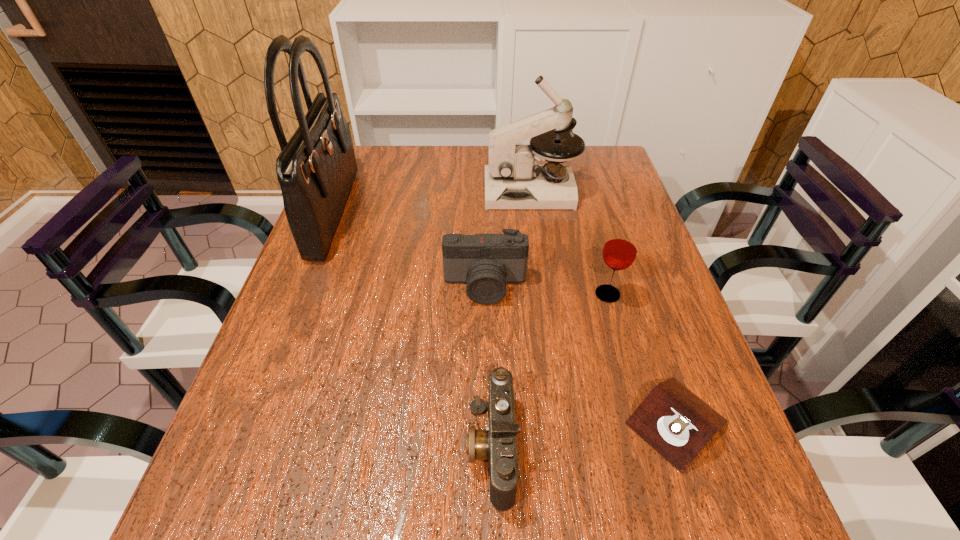
The width and height of the screenshot is (960, 540). What are the coordinates of `vacant space located at the eyepiece of the second tallest object` in the screenshot? It's located at (400, 191).

Find the location of a particular element. This screenshot has height=540, width=960. free space located at the eyepiece of the second tallest object is located at coordinates (404, 191).

Where is `free space located at the eyepiece of the second tallest object`? This screenshot has width=960, height=540. free space located at the eyepiece of the second tallest object is located at coordinates (407, 191).

Where is `vacant region located on the left of the glass`? This screenshot has height=540, width=960. vacant region located on the left of the glass is located at coordinates (453, 294).

This screenshot has width=960, height=540. I want to click on free spot located at the lens of the fourth tallest object, so click(x=487, y=397).

Where is `vacant region located 0.080m on the front-facing side of the second shortest object`? Image resolution: width=960 pixels, height=540 pixels. vacant region located 0.080m on the front-facing side of the second shortest object is located at coordinates (421, 447).

Identify the location of free space located on the front-facing side of the second shortest object. The width and height of the screenshot is (960, 540). (404, 447).

Locate an element on the screen. The height and width of the screenshot is (540, 960). vacant region located on the front-facing side of the second shortest object is located at coordinates (295, 447).

Where is `free space located on the left of the shortest object`? free space located on the left of the shortest object is located at coordinates (453, 422).

Locate an element on the screen. handbag positioned at the far edge is located at coordinates (316, 168).